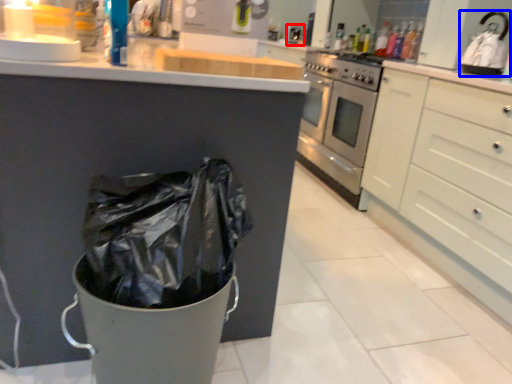
Question: Which object is further to the camera taking this photo, sink (highlighted by a red box) or appliance (highlighted by a blue box)?

Choices:
 (A) sink
 (B) appliance

Answer: (A)